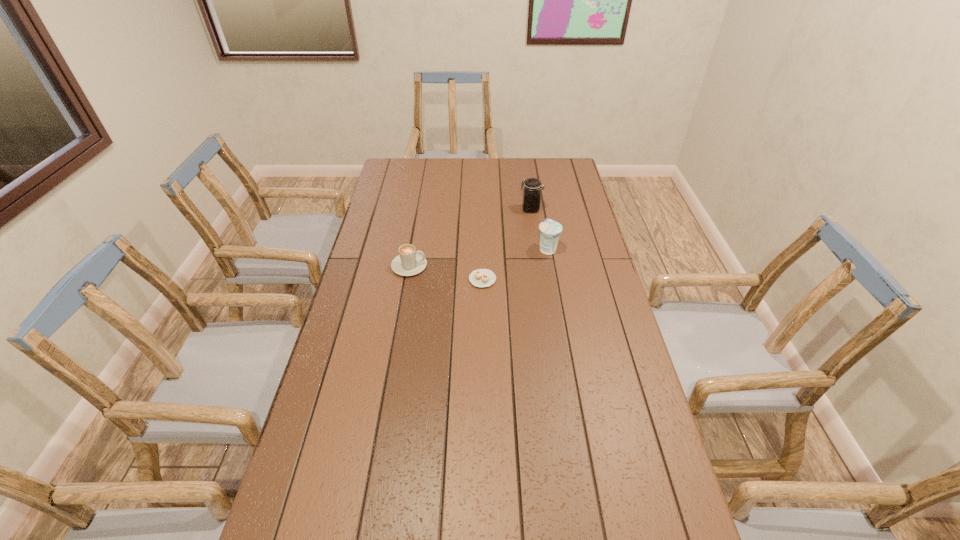
Where is `vacant point located on the left of the yogurt`? The image size is (960, 540). vacant point located on the left of the yogurt is located at coordinates (502, 249).

The height and width of the screenshot is (540, 960). I want to click on free spot located to the right of the leftmost object, so click(463, 266).

The width and height of the screenshot is (960, 540). Identify the location of vacant area situated 0.320m on the left of the shortest object. (377, 280).

At what (x,y) coordinates should I click in order to perform the action: click on object at the left edge. Please return your answer as a coordinate pair (x, y). The width and height of the screenshot is (960, 540). Looking at the image, I should click on (409, 262).

The image size is (960, 540). Find the location of `object at the right edge`. object at the right edge is located at coordinates (550, 230).

This screenshot has width=960, height=540. Find the location of `vacant space at the far edge of the desktop`. vacant space at the far edge of the desktop is located at coordinates (490, 165).

Image resolution: width=960 pixels, height=540 pixels. Find the location of `vacant space at the left edge`. vacant space at the left edge is located at coordinates (362, 355).

The image size is (960, 540). Identify the location of free spot at the right edge of the desktop. (640, 434).

In the image, there is a desktop. Where is `vacant space at the far left corner`? vacant space at the far left corner is located at coordinates (420, 166).

Where is `empty space between the shortest object and the second tallest object`? The image size is (960, 540). empty space between the shortest object and the second tallest object is located at coordinates (515, 264).